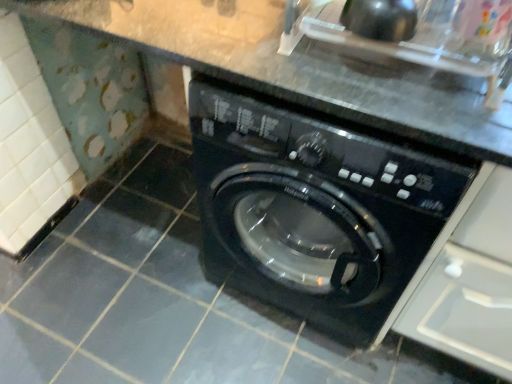
Question: Should I look upward or downward to see white plastic drawer at upper right?

Choices:
 (A) down
 (B) up

Answer: (A)

Question: Can you confirm if black glossy washing machine at center is positioned to the left of white plastic drawer at upper right?

Choices:
 (A) yes
 (B) no

Answer: (A)

Question: From a real-world perspective, is black glossy washing machine at center located higher than white plastic drawer at upper right?

Choices:
 (A) yes
 (B) no

Answer: (A)

Question: From the image's perspective, would you say black glossy washing machine at center is positioned over white plastic drawer at upper right?

Choices:
 (A) yes
 (B) no

Answer: (A)

Question: Is black glossy washing machine at center closer to camera compared to white plastic drawer at upper right?

Choices:
 (A) yes
 (B) no

Answer: (B)

Question: Is black glossy washing machine at center outside of white plastic drawer at upper right?

Choices:
 (A) no
 (B) yes

Answer: (B)

Question: Can you see black glossy washing machine at center touching white plastic drawer at upper right?

Choices:
 (A) yes
 (B) no

Answer: (B)

Question: Is black glossy sink at upper right shorter than white plastic drawer at upper right?

Choices:
 (A) yes
 (B) no

Answer: (A)

Question: From the image's perspective, is black glossy sink at upper right under white plastic drawer at upper right?

Choices:
 (A) no
 (B) yes

Answer: (A)

Question: Does black glossy sink at upper right have a greater width compared to white plastic drawer at upper right?

Choices:
 (A) yes
 (B) no

Answer: (B)

Question: Is the depth of black glossy sink at upper right greater than that of white plastic drawer at upper right?

Choices:
 (A) yes
 (B) no

Answer: (A)

Question: Can you confirm if black glossy sink at upper right is smaller than white plastic drawer at upper right?

Choices:
 (A) no
 (B) yes

Answer: (B)

Question: From the image's perspective, is black glossy sink at upper right located above white plastic drawer at upper right?

Choices:
 (A) yes
 (B) no

Answer: (A)

Question: Considering the relative sizes of white plastic drawer at upper right and black glossy sink at upper right in the image provided, is white plastic drawer at upper right bigger than black glossy sink at upper right?

Choices:
 (A) no
 (B) yes

Answer: (B)